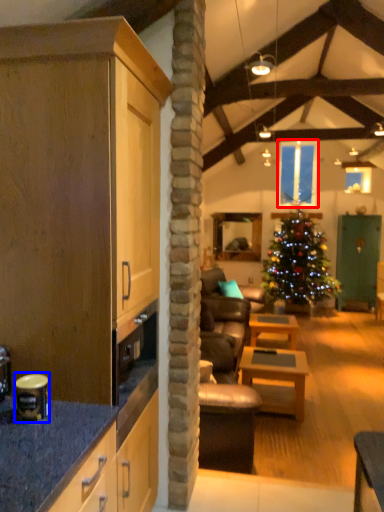
Question: Which of the following is the closest to the observer, window (highlighted by a red box) or appliance (highlighted by a blue box)?

Choices:
 (A) window
 (B) appliance

Answer: (B)